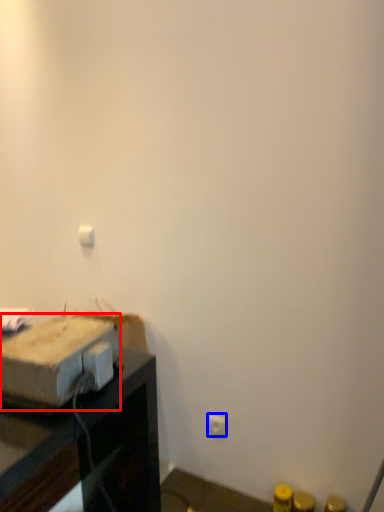
Question: Which object appears farthest to the camera in this image, cardboard box (highlighted by a red box) or electric outlet (highlighted by a blue box)?

Choices:
 (A) cardboard box
 (B) electric outlet

Answer: (B)